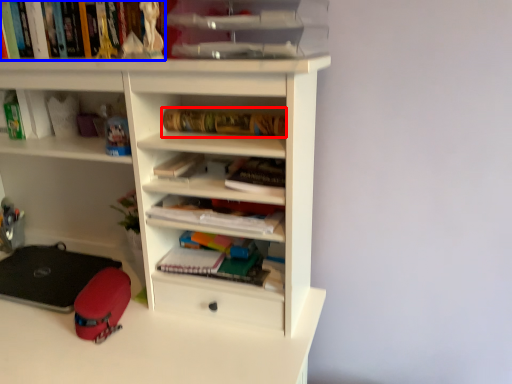
Question: Which of the following is the farthest to the observer, book (highlighted by a red box) or book (highlighted by a blue box)?

Choices:
 (A) book
 (B) book

Answer: (A)